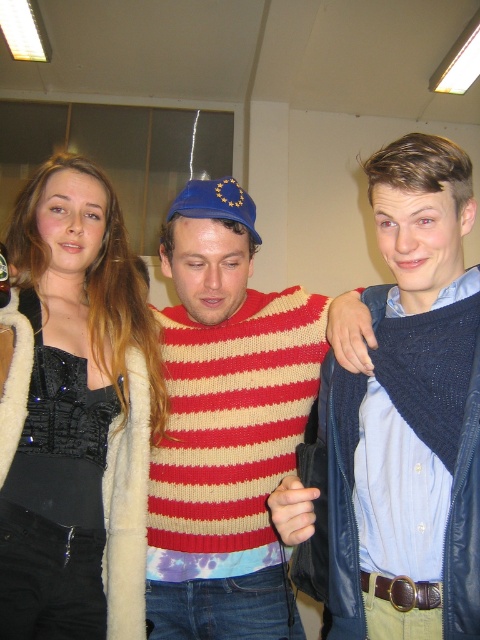
Question: Among these points, which one is farthest from the camera?

Choices:
 (A) [x=286, y=420]
 (B) [x=6, y=582]

Answer: (A)

Question: Is knitted wool sweater at center above black sequined top at left?

Choices:
 (A) no
 (B) yes

Answer: (A)

Question: Considering the real-world distances, which object is farthest from the cable-knit sweater at right?

Choices:
 (A) black sequined top at left
 (B) knitted wool sweater at center

Answer: (A)

Question: Does cable-knit sweater at right have a larger size compared to black sequined top at left?

Choices:
 (A) no
 (B) yes

Answer: (A)

Question: Estimate the real-world distances between objects in this image. Which object is farther from the black sequined top at left?

Choices:
 (A) knitted wool sweater at center
 (B) cable-knit sweater at right

Answer: (B)

Question: Observing the image, what is the correct spatial positioning of cable-knit sweater at right in reference to knitted wool sweater at center?

Choices:
 (A) above
 (B) below

Answer: (A)